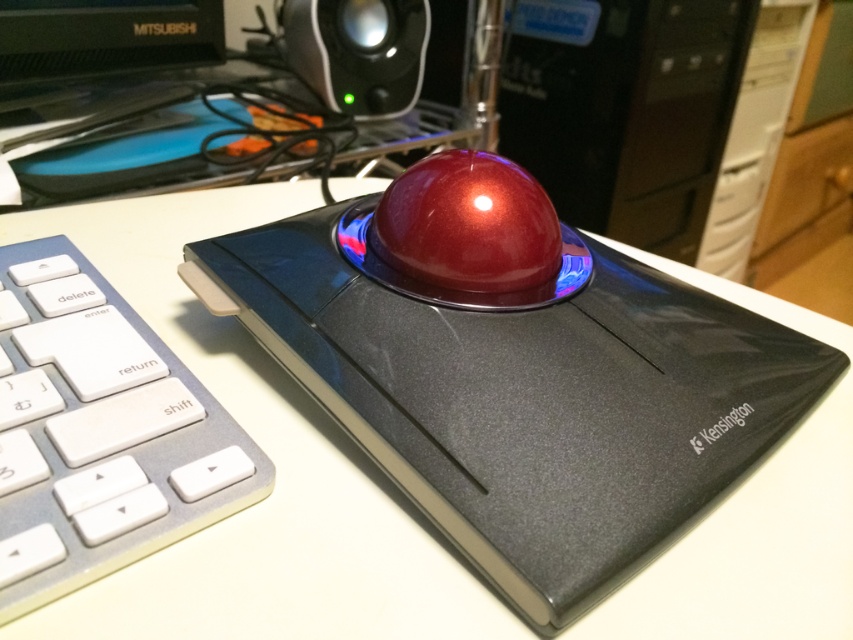
Question: Considering the real-world distances, which object is farthest from the metallic red trackball at center?

Choices:
 (A) white plastic keyboard at lower left
 (B) metallic black speaker at upper center

Answer: (B)

Question: Does white plastic keyboard at lower left appear over metallic black speaker at upper center?

Choices:
 (A) no
 (B) yes

Answer: (A)

Question: Is the position of metallic red trackball at center less distant than that of white plastic keyboard at lower left?

Choices:
 (A) no
 (B) yes

Answer: (A)

Question: Which of the following is the farthest from the observer?

Choices:
 (A) metallic black speaker at upper center
 (B) metallic red trackball at center

Answer: (A)

Question: Does metallic red trackball at center have a greater width compared to white plastic keyboard at lower left?

Choices:
 (A) yes
 (B) no

Answer: (A)

Question: Which object is the farthest from the white plastic keyboard at lower left?

Choices:
 (A) metallic red trackball at center
 (B) metallic black speaker at upper center

Answer: (B)